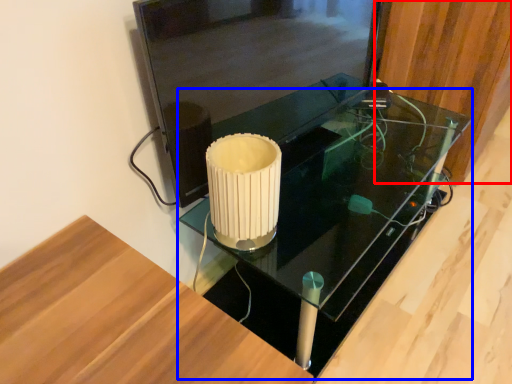
Question: Which object appears closest to the camera in this image, wood (highlighted by a red box) or table (highlighted by a blue box)?

Choices:
 (A) wood
 (B) table

Answer: (B)